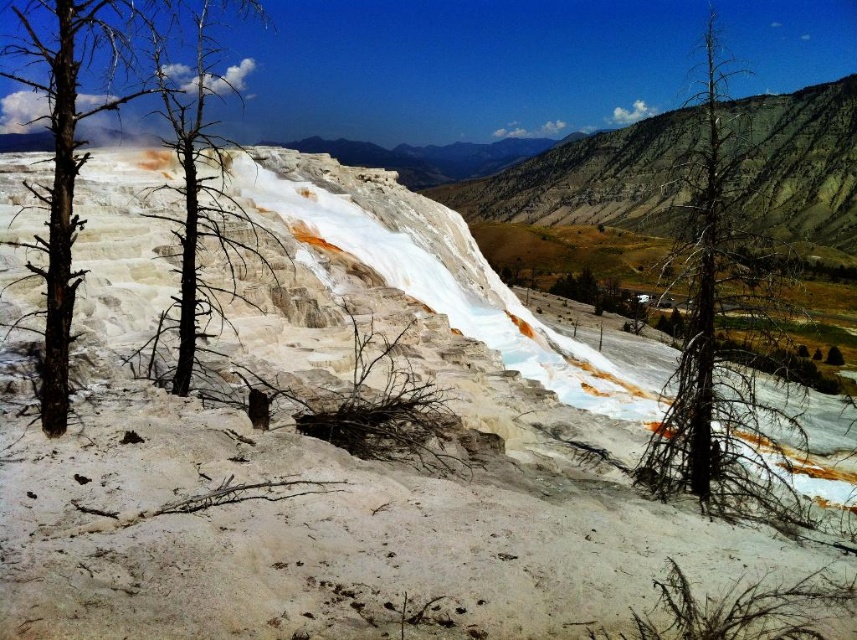
You are a park ranger assessing the terrain. You see a dead wood tree at center and a black dead tree at center. Which one is taller?

The dead wood tree at center is much taller than the black dead tree at center.

You are a park ranger assessing the health of trees in a geothermal area. You notice a dead wood tree at center and a charred wood tree at left. Which tree is taller?

The dead wood tree at center is taller than the charred wood tree at left.